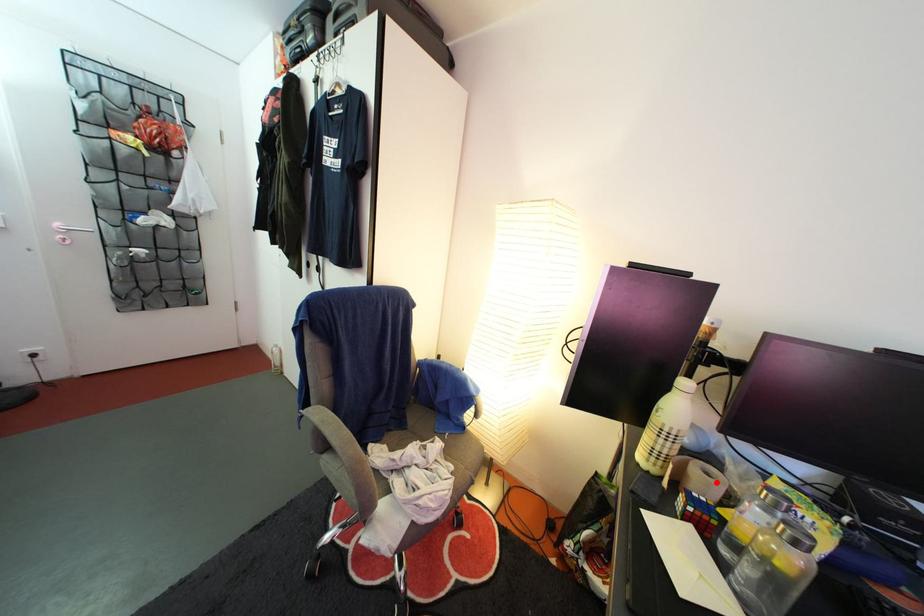
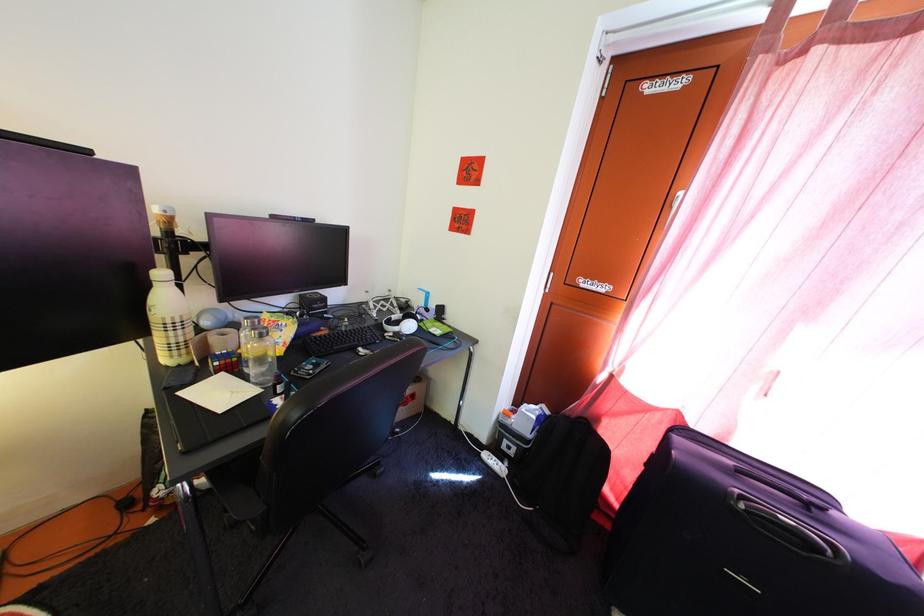
Question: I am providing you with two images of the same scene from different viewpoints. Given a red point in image1, look at the same physical point in image2. Is it:

Choices:
 (A) Closer to the viewpoint
 (B) Farther from the viewpoint

Answer: (B)